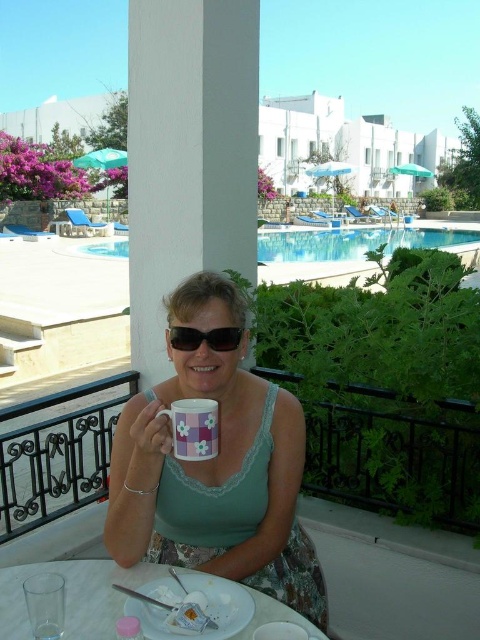
Question: Does white glossy plate at lower center have a lesser width compared to matte plastic sunglasses at center?

Choices:
 (A) yes
 (B) no

Answer: (B)

Question: Can you confirm if matte plastic sunglasses at center is bigger than transparent plastic cup at lower left?

Choices:
 (A) yes
 (B) no

Answer: (A)

Question: Among these objects, which one is farthest from the camera?

Choices:
 (A) matte plastic sunglasses at center
 (B) white smooth pillar at center

Answer: (B)

Question: Which of the following is the closest to the observer?

Choices:
 (A) (186, 452)
 (B) (57, 628)
 (C) (201, 332)

Answer: (B)

Question: Which of these objects is positioned farthest from the matte plastic sunglasses at center?

Choices:
 (A) blue glassy swimming pool at upper center
 (B) pink floral mug at center
 (C) white smooth pillar at center

Answer: (A)

Question: Can you confirm if pastel floral mug at center is positioned to the right of matte plastic sunglasses at center?

Choices:
 (A) no
 (B) yes

Answer: (A)